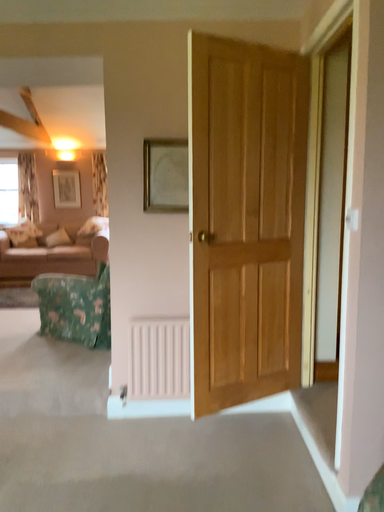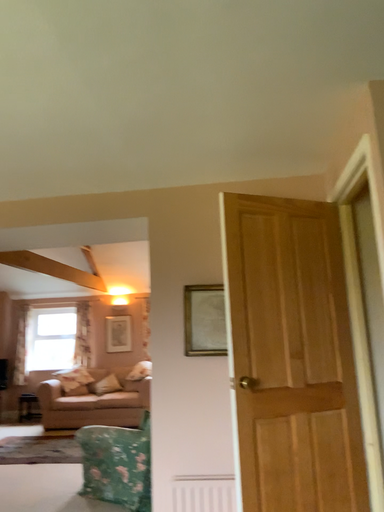
Question: Which way did the camera rotate in the video?

Choices:
 (A) rotated downward
 (B) rotated upward

Answer: (B)